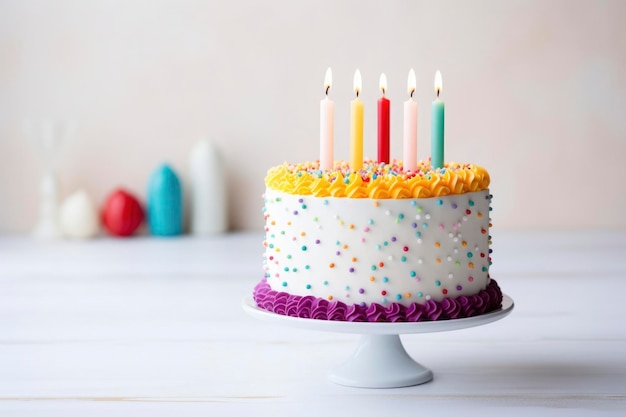
Image resolution: width=626 pixels, height=417 pixels. Find the location of `vases in background`. vases in background is located at coordinates (203, 166), (163, 186), (121, 198), (83, 208), (52, 209).